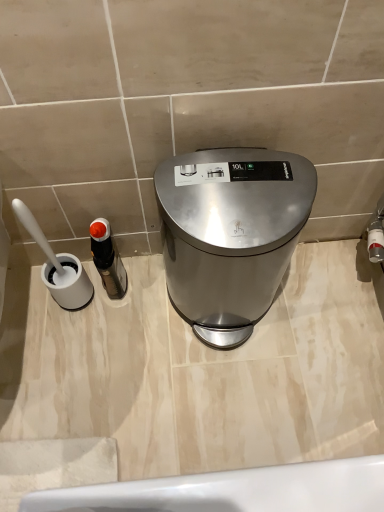
Question: Would you say black plastic bottle at left is inside or outside satin silver trash can at center?

Choices:
 (A) inside
 (B) outside

Answer: (B)

Question: Is point pyautogui.click(x=104, y=272) positioned closer to the camera than point pyautogui.click(x=198, y=272)?

Choices:
 (A) farther
 (B) closer

Answer: (A)

Question: Considering the positions of black plastic bottle at left and satin silver trash can at center in the image, is black plastic bottle at left bigger or smaller than satin silver trash can at center?

Choices:
 (A) small
 (B) big

Answer: (A)

Question: Would you say satin silver trash can at center is to the left or to the right of black plastic bottle at left in the picture?

Choices:
 (A) left
 (B) right

Answer: (B)

Question: Considering the positions of satin silver trash can at center and black plastic bottle at left in the image, is satin silver trash can at center bigger or smaller than black plastic bottle at left?

Choices:
 (A) small
 (B) big

Answer: (B)

Question: From a real-world perspective, is satin silver trash can at center positioned above or below black plastic bottle at left?

Choices:
 (A) above
 (B) below

Answer: (A)

Question: Is satin silver trash can at center wider or thinner than black plastic bottle at left?

Choices:
 (A) wide
 (B) thin

Answer: (A)